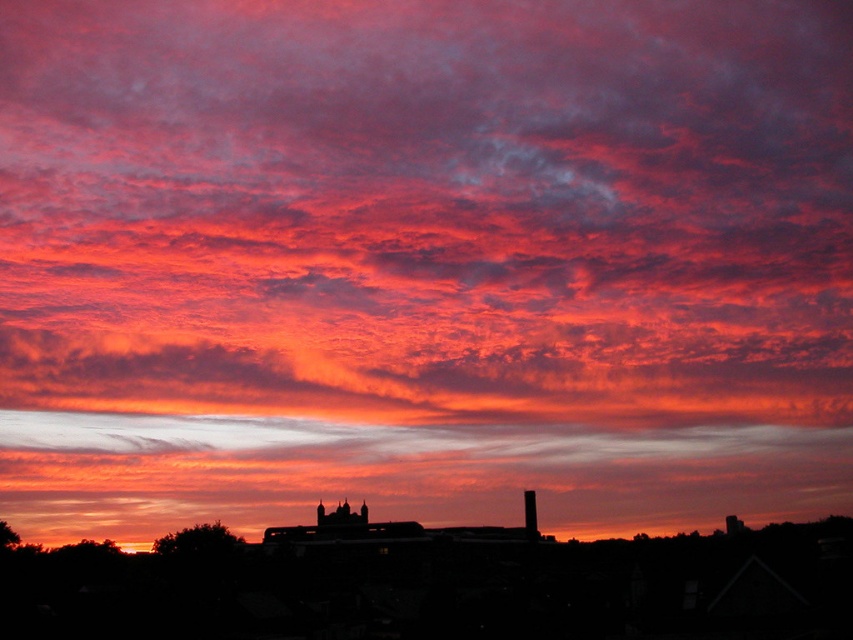
You are an architect analyzing the silhouette of the building in the sunset scene. You notice a point labeled at coordinates (341, 515). Based on the scene description, what does this point likely represent?

The point at (341, 515) marks the location of the black matte chimney at center, which is part of the building silhouette in the sunset scene.

You are an architect analyzing the silhouette of two chimneys in the sunset scene. Which of the two chimneys, the black matte chimney at center or the black brick chimney at center, appears closer to you?

The black matte chimney at center appears closer to you because it is positioned further to the viewer than the black brick chimney at center.

You are an architect analyzing the sunset scene. You need to determine the position of the black matte chimney at center in the image. What are its coordinates?

The coordinates of the black matte chimney at center are at point (x=341, y=515).